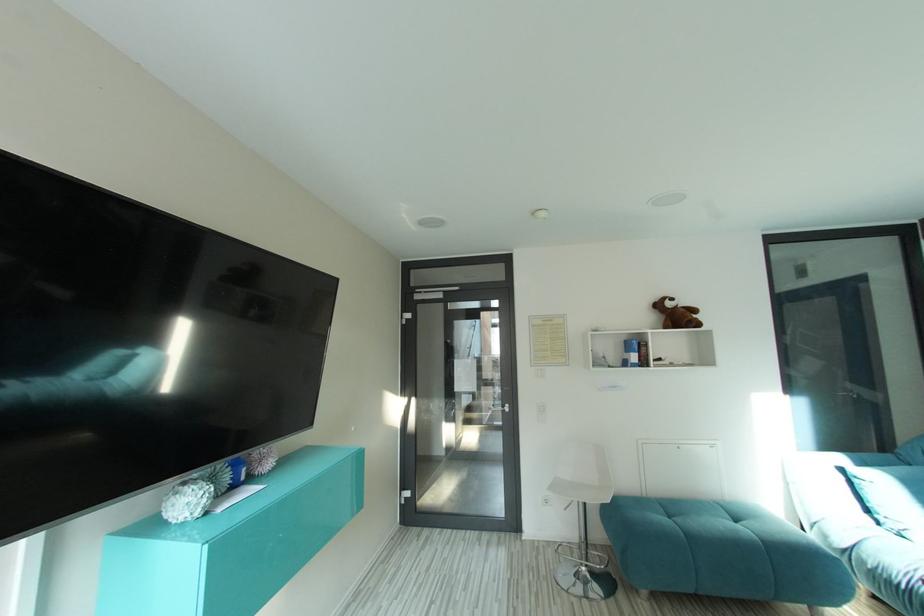
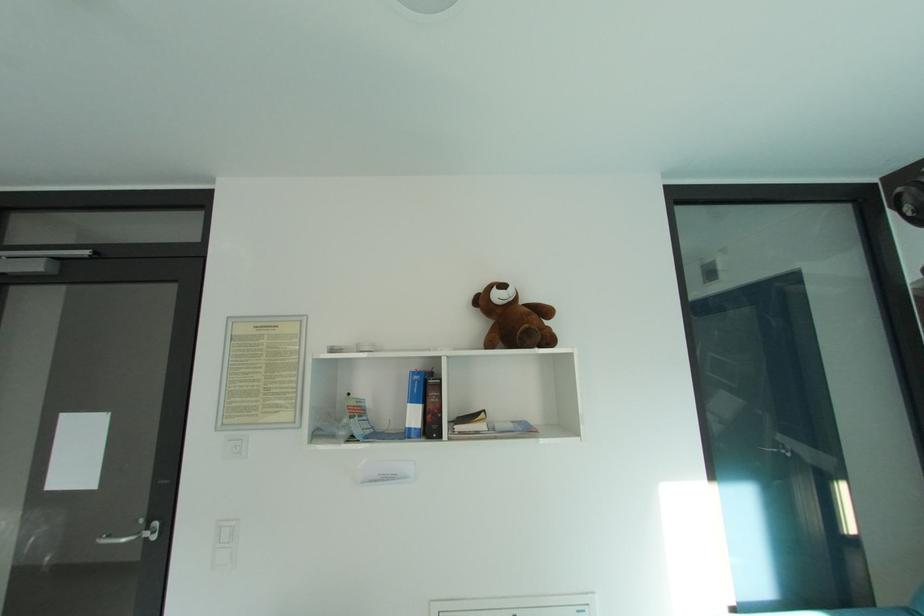
What movement of the cameraman would produce the second image?

The movement direction of the cameraman is right, forward.